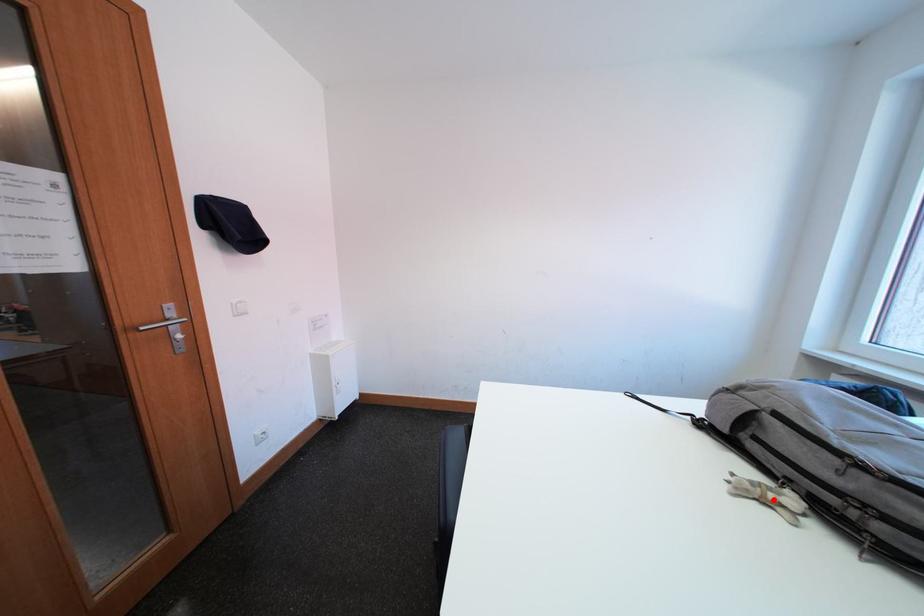
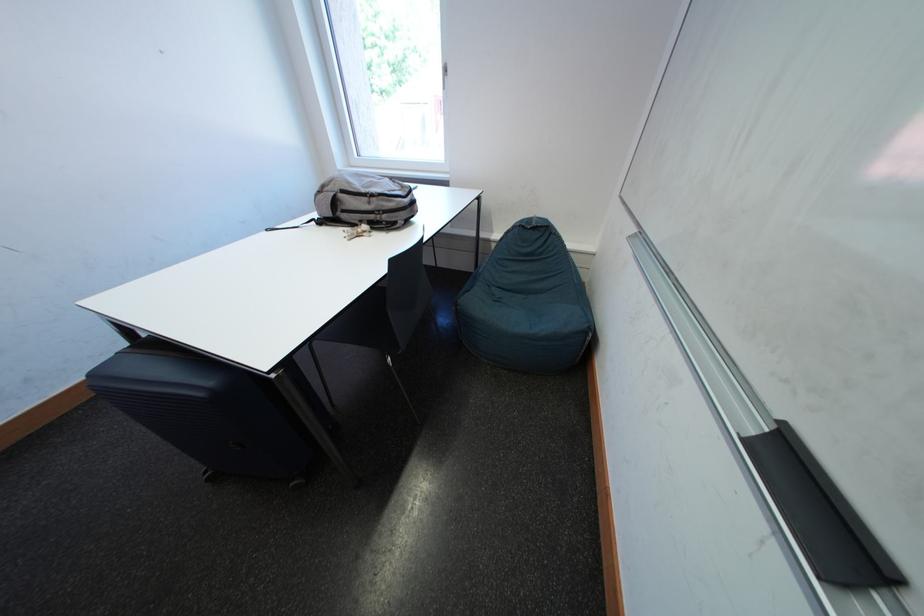
Find the pixel in the second image that matches the highlighted location in the first image.

(368, 236)